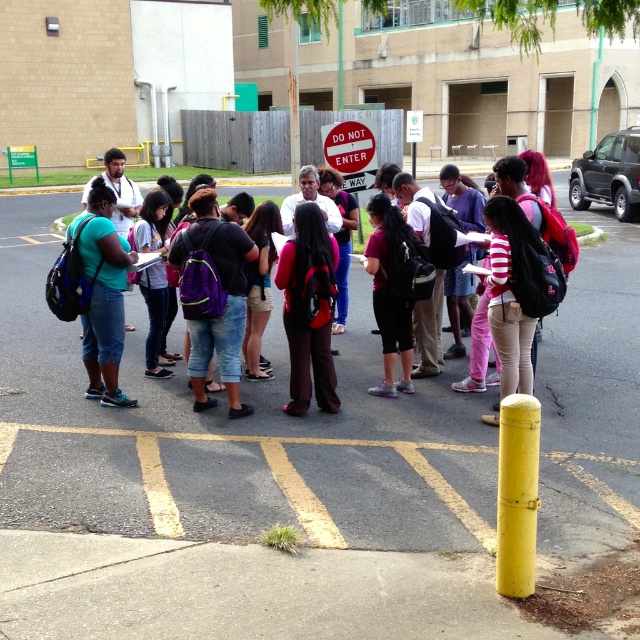
Is yellow asphalt parking line at lower center smaller than matte black backpack at center?

Yes.

Which is behind, point (452, 506) or point (490, 289)?

The point (490, 289) is behind.

This screenshot has height=640, width=640. I want to click on yellow asphalt parking line at lower center, so click(x=273, y=476).

Is matte black backpack at center to the right of red matte stop sign at center from the viewer's perspective?

Yes, matte black backpack at center is to the right of red matte stop sign at center.

Does point (458, 214) come in front of point (355, 154)?

Yes, it is in front of point (355, 154).

Is point (524, 227) positioned after point (339, 154)?

No, it is in front of (339, 154).

At what (x,y) coordinates should I click in order to perform the action: click on matte black backpack at center. Please return your answer as a coordinate pair (x, y). The width and height of the screenshot is (640, 640). Looking at the image, I should click on (518, 266).

Is yellow asphalt parking line at lower center above red matte stop sign at center?

No.

Describe the element at coordinates (273, 476) in the screenshot. I see `yellow asphalt parking line at lower center` at that location.

This screenshot has width=640, height=640. Describe the element at coordinates (273, 476) in the screenshot. I see `yellow asphalt parking line at lower center` at that location.

This screenshot has height=640, width=640. What are the coordinates of `yellow asphalt parking line at lower center` in the screenshot? It's located at (273, 476).